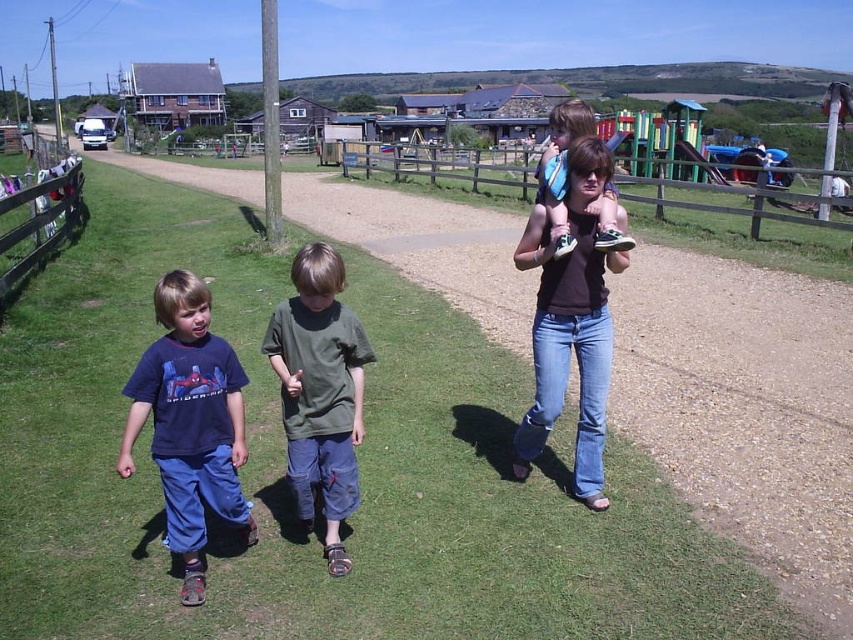
Looking at this image, does green cotton shirt at center appear on the right side of wooden fence at center?

Incorrect, green cotton shirt at center is not on the right side of wooden fence at center.

Where is `green cotton shirt at center`? green cotton shirt at center is located at coordinates (320, 392).

Can you confirm if wooden fence at center is shorter than wooden fence at left?

No, wooden fence at center is not shorter than wooden fence at left.

Is wooden fence at center above wooden fence at left?

Yes.

Where is `wooden fence at center`? The image size is (853, 640). wooden fence at center is located at coordinates coord(440,164).

Find the location of a particular element. This screenshot has height=640, width=853. wooden fence at center is located at coordinates (440, 164).

Consider the image. How much distance is there between matte brown shirt at center and matte blue sneakers at center?

They are 81.65 centimeters apart.

Between point (602, 256) and point (563, 252), which one is positioned in front?

Positioned in front is point (563, 252).

In the scene shown: Who is more distant from viewer, (567,337) or (630,237)?

The point (630,237) is more distant.

Find the location of a particular element. This screenshot has height=640, width=853. matte brown shirt at center is located at coordinates (570, 324).